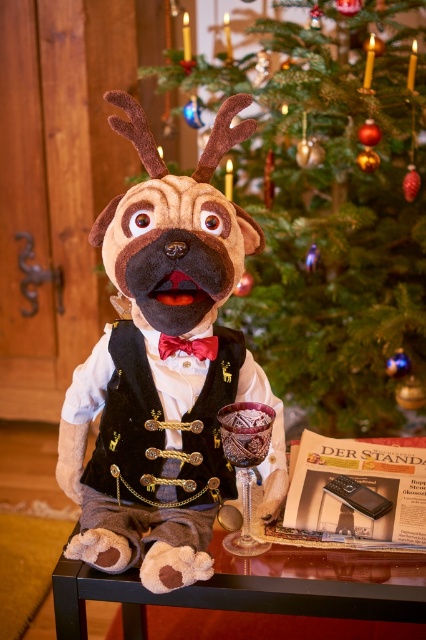
You are a guest at a party and want to pour a drink from the translucent purple glass goblet at lower center into a cup. However, the felt plush dog at center is blocking the way. Can you move the dog to access the goblet?

The felt plush dog at center is in front of the translucent purple glass goblet at lower center, so you need to move the felt plush dog at center to access the goblet.

You are a guest at a party and want to place a small gift on the shiny dark wood table at lower center. However, you notice the red satin bow tie at center is already occupying space on the table. Can the gift be placed on the table without moving the bow tie?

The shiny dark wood table at lower center is wider than the red satin bow tie at center, so there is enough space to place the gift on the table without moving the bow tie.

You are a guest at a party and see the felt plush dog at center and the translucent purple glass goblet at lower center on the table. Which object is closer to you?

The felt plush dog at center is above the translucent purple glass goblet at lower center, so it is closer to you.